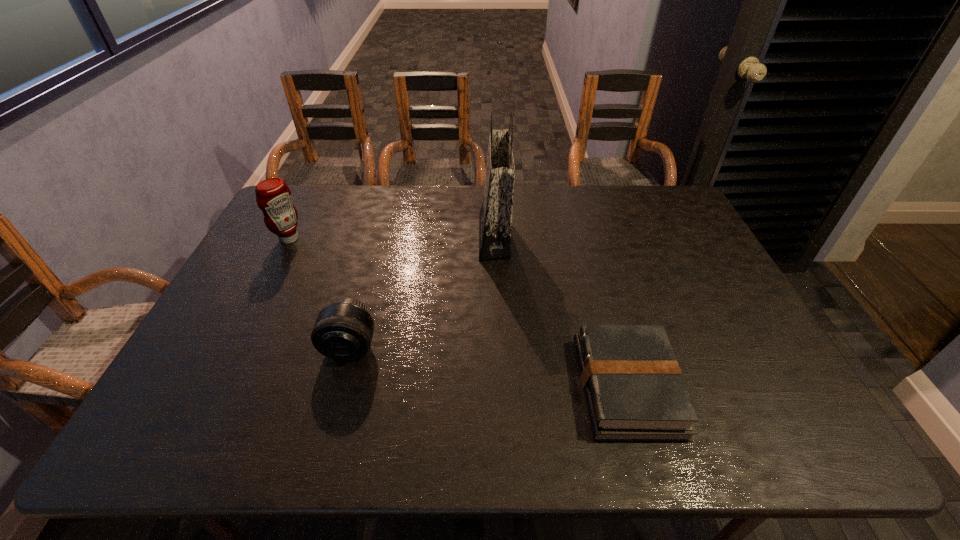
Locate an element on the screen. The height and width of the screenshot is (540, 960). free region located on the front of the shopping bag with the design is located at coordinates (378, 236).

Locate an element on the screen. The width and height of the screenshot is (960, 540). vacant area located 0.280m on the back of the third shortest object is located at coordinates pos(316,185).

At what (x,y) coordinates should I click in order to perform the action: click on free space located 0.180m on the front-facing side of the telephoto lens. Please return your answer as a coordinate pair (x, y). The width and height of the screenshot is (960, 540). Looking at the image, I should click on (326, 436).

Identify the location of vacant space situated 0.060m on the spine side of the rightmost object. This screenshot has width=960, height=540. pos(555,387).

Locate an element on the screen. free space located on the spine side of the rightmost object is located at coordinates (534, 387).

Locate an element on the screen. vacant space located 0.220m on the spine side of the rightmost object is located at coordinates (486, 387).

Find the location of a particular element. object at the far edge is located at coordinates (495, 218).

In order to click on object positioned at the near edge in this screenshot , I will do `click(634, 390)`.

Locate an element on the screen. object present at the left edge is located at coordinates (273, 196).

Where is `free point at the far edge`? The image size is (960, 540). free point at the far edge is located at coordinates (x=441, y=210).